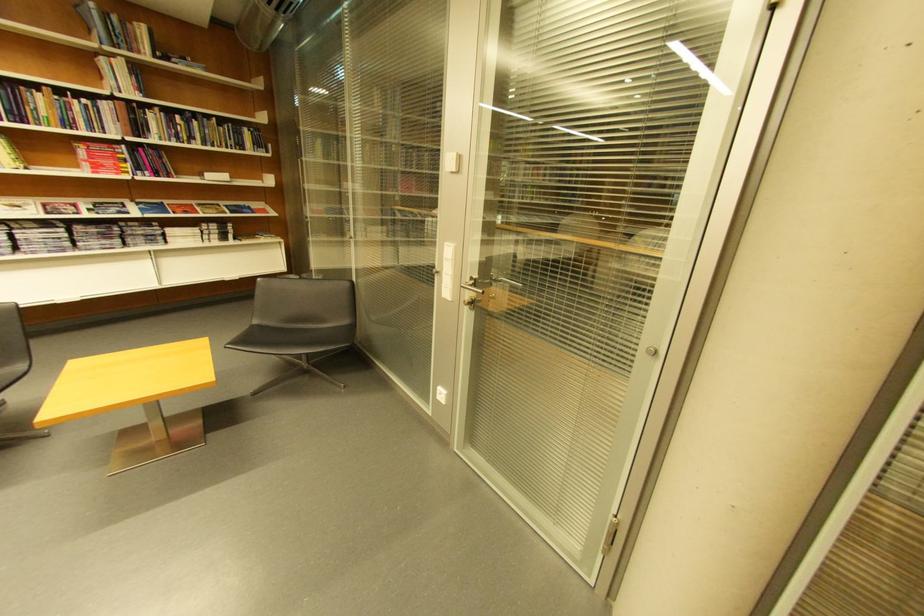
Where would you press the white light switch? Please return your answer as a coordinate pair (x, y).

(451, 161)